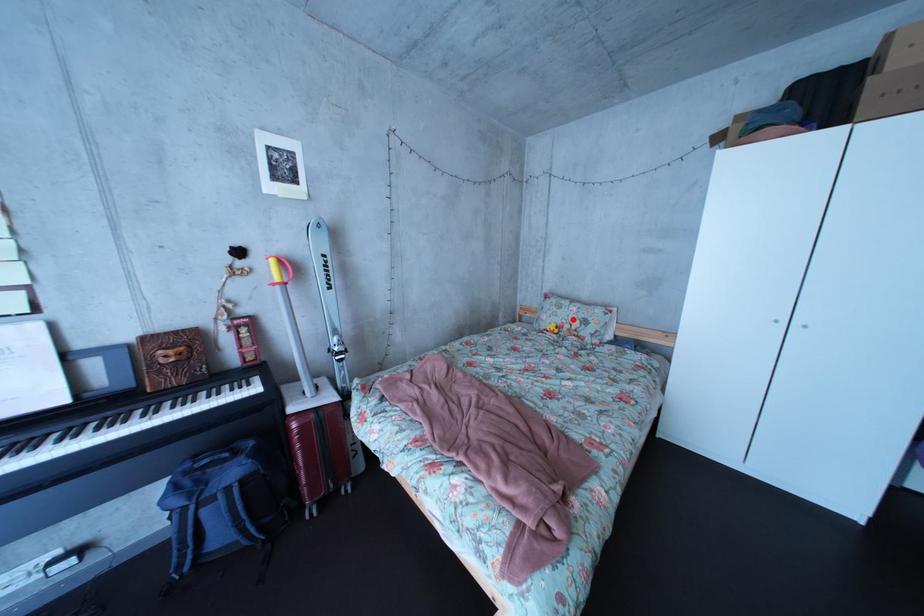
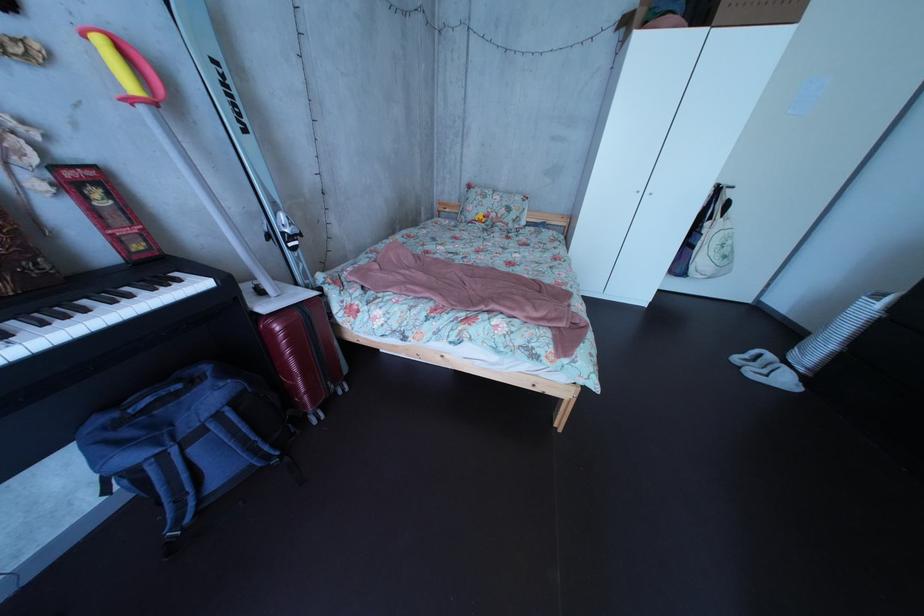
Locate, in the second image, the point that corresponds to the highlighted location in the first image.

(499, 209)